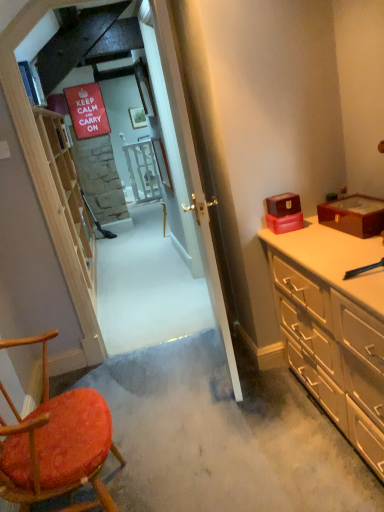
At what (x,y) coordinates should I click in order to perform the action: click on free space on the front side of shiny burgundy box at right, which appears as the second box when viewed from the left. Please return your answer as a coordinate pair (x, y). The image size is (384, 512). Looking at the image, I should click on (350, 250).